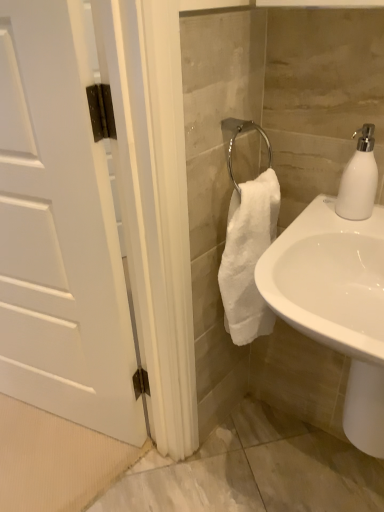
Describe the element at coordinates (336, 302) in the screenshot. I see `white glossy sink at lower right` at that location.

What is the approximate width of white glossy sink at lower right?

white glossy sink at lower right is 49.12 centimeters in width.

Identify the location of white matte soap dispenser at upper right. (359, 179).

Between white glossy sink at lower right and white matte soap dispenser at upper right, which one appears on the left side from the viewer's perspective?

Positioned to the left is white glossy sink at lower right.

Is white glossy sink at lower right positioned with its back to white matte soap dispenser at upper right?

No, white matte soap dispenser at upper right is not at the back of white glossy sink at lower right.

Is white glossy sink at lower right not near white matte soap dispenser at upper right?

white glossy sink at lower right is near white matte soap dispenser at upper right, not far away.

Is white glossy sink at lower right outside of white matte soap dispenser at upper right?

Yes, white glossy sink at lower right is not within white matte soap dispenser at upper right.

You are a GUI agent. You are given a task and a screenshot of the screen. Output one action in this format:
    pyautogui.click(x=<x>, y=<y>)
    Task: Click on the door lying on the left of white matte soap dispenser at upper right
    This screenshot has height=512, width=384.
    Given the screenshot: What is the action you would take?
    pyautogui.click(x=59, y=231)

Are white matte soap dispenser at upper right and white matte door at left located far from each other?

No, there isn't a large distance between white matte soap dispenser at upper right and white matte door at left.

Is white matte soap dispenser at upper right looking in the opposite direction of white matte door at left?

That's not correct — white matte soap dispenser at upper right is not looking away from white matte door at left.

How many degrees apart are the facing directions of white matte soap dispenser at upper right and white matte door at left?

They differ by 11.3 degrees in their facing directions.

Where is `sink that is under the white matte soap dispenser at upper right (from a real-world perspective)`? The height and width of the screenshot is (512, 384). sink that is under the white matte soap dispenser at upper right (from a real-world perspective) is located at coordinates (336, 302).

Are white matte soap dispenser at upper right and white glossy sink at lower right far apart?

No, white matte soap dispenser at upper right is not far away from white glossy sink at lower right.

Who is taller, white matte soap dispenser at upper right or white glossy sink at lower right?

Standing taller between the two is white glossy sink at lower right.

From the image's perspective, is white matte soap dispenser at upper right above or below white glossy sink at lower right?

white matte soap dispenser at upper right is above white glossy sink at lower right.

From a real-world perspective, is white matte door at left physically located above or below white matte soap dispenser at upper right?

white matte door at left is situated lower than white matte soap dispenser at upper right in the real world.

What are the coordinates of `soap dispenser located behind the white matte door at left` in the screenshot? It's located at (359, 179).

Which of these two, white matte door at left or white matte soap dispenser at upper right, stands taller?

Standing taller between the two is white matte door at left.

What's the angular difference between white matte door at left and white glossy sink at lower right's facing directions?

They differ by 11.3 degrees in their facing directions.

Is white matte door at left facing towards white glossy sink at lower right?

No, white matte door at left does not turn towards white glossy sink at lower right.

From a real-world perspective, which object stands above the other?

white matte door at left is physically above.

The width and height of the screenshot is (384, 512). In order to click on door on the left side of white glossy sink at lower right in this screenshot , I will do `click(59, 231)`.

Which object is thinner, white glossy sink at lower right or white matte door at left?

With smaller width is white matte door at left.

Is white glossy sink at lower right not within white matte door at left?

That's correct, white glossy sink at lower right is outside of white matte door at left.

Is white glossy sink at lower right further to the viewer compared to white matte door at left?

No.

From a real-world perspective, who is located higher, white glossy sink at lower right or white matte door at left?

white matte door at left is physically above.

Where is `sink below the white matte soap dispenser at upper right (from a real-world perspective)`? The height and width of the screenshot is (512, 384). sink below the white matte soap dispenser at upper right (from a real-world perspective) is located at coordinates (336, 302).

I want to click on soap dispenser that appears on the right of white matte door at left, so click(x=359, y=179).

Based on their spatial positions, is white matte soap dispenser at upper right or white matte door at left further from white glossy sink at lower right?

The object further to white glossy sink at lower right is white matte door at left.

Considering their positions, is white glossy sink at lower right positioned further to white matte soap dispenser at upper right than white matte door at left?

Based on the image, white matte door at left appears to be further to white matte soap dispenser at upper right.

When comparing their distances from white glossy sink at lower right, does white matte door at left or white matte soap dispenser at upper right seem further?

white matte door at left lies further to white glossy sink at lower right than the other object.

Based on their spatial positions, is white matte door at left or white glossy sink at lower right closer to white matte soap dispenser at upper right?

The object closer to white matte soap dispenser at upper right is white glossy sink at lower right.

Based on their spatial positions, is white glossy sink at lower right or white matte soap dispenser at upper right closer to white matte door at left?

white glossy sink at lower right is positioned closer to the anchor white matte door at left.

Considering their positions, is white matte soap dispenser at upper right positioned closer to white matte door at left than white glossy sink at lower right?

white glossy sink at lower right lies closer to white matte door at left than the other object.

Find the location of a particular element. The width and height of the screenshot is (384, 512). sink situated between white matte door at left and white matte soap dispenser at upper right from left to right is located at coordinates (336, 302).